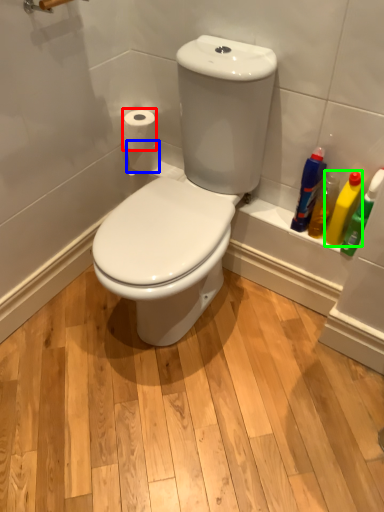
Question: Based on their relative distances, which object is nearer to toilet paper (highlighted by a red box)? Choose from toilet paper (highlighted by a blue box) and cleaning product (highlighted by a green box).

Choices:
 (A) toilet paper
 (B) cleaning product

Answer: (A)